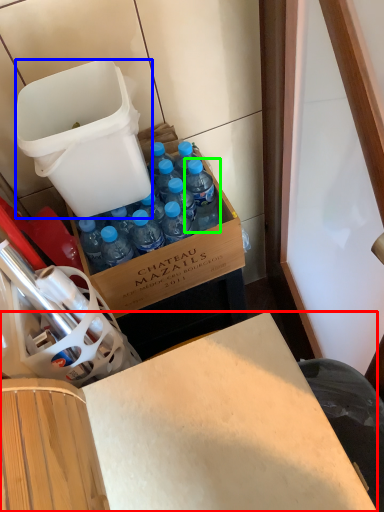
Question: Which object is positioned farthest from desk (highlighted by a red box)? Select from trash bin/can (highlighted by a blue box) and bottle (highlighted by a green box).

Choices:
 (A) trash bin/can
 (B) bottle

Answer: (A)